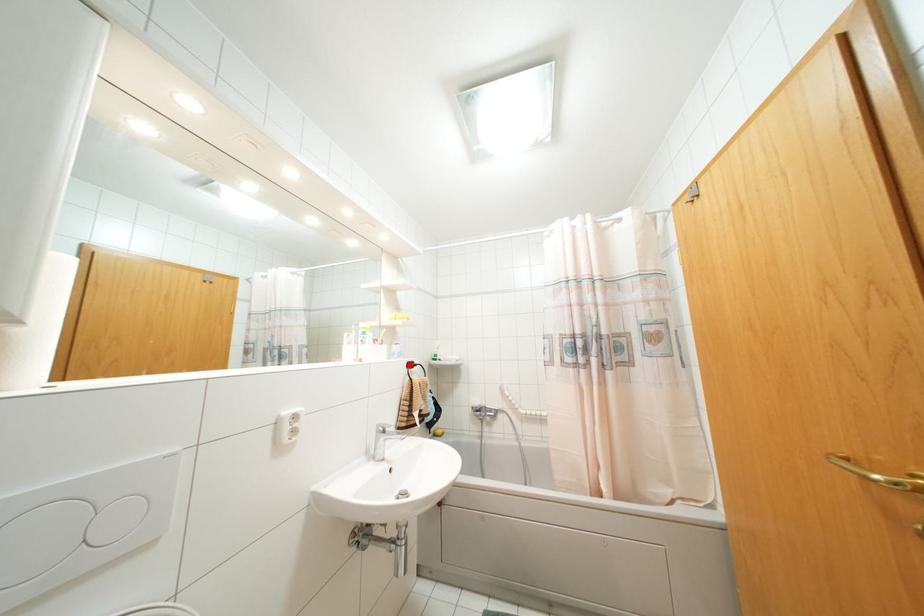
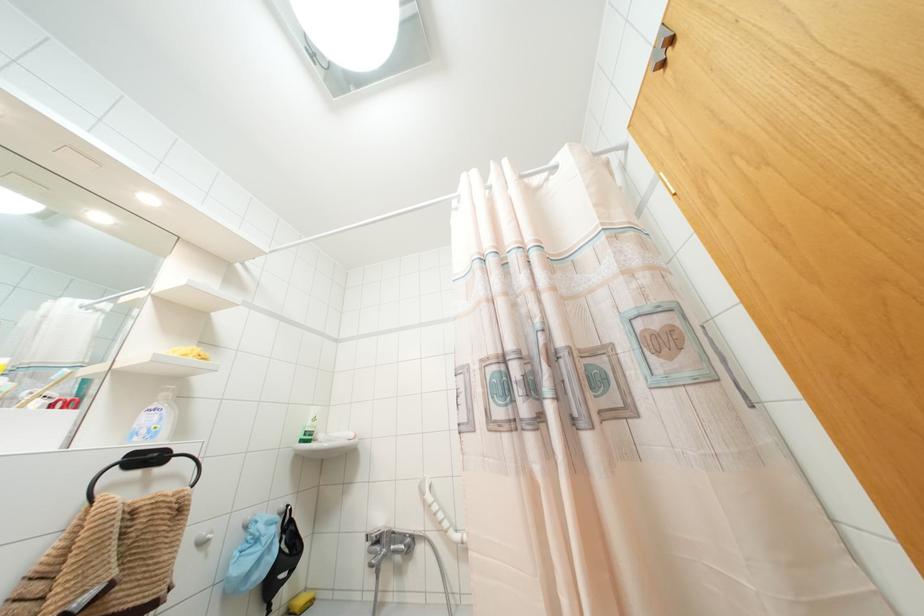
In the second image, find the point that corresponds to the highlighted location in the first image.

(147, 458)